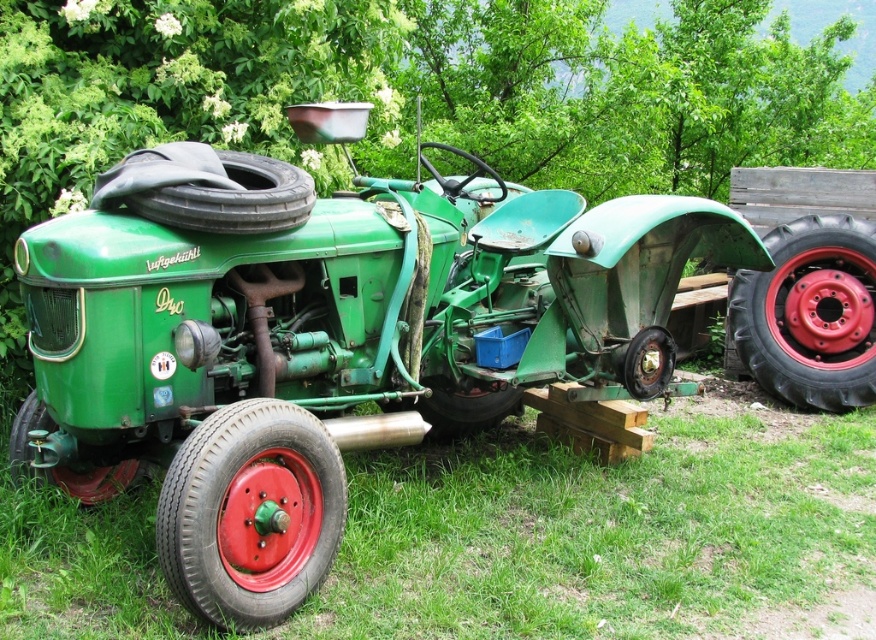
You are a farmer who needs to move a heavy object from the tractor to the barn, which is 3.27 meters away. The tractor has a black rubber tire at center. Can you use the tractor to transport the object to the barn?

The distance between the tractor and the barn is 3.27 meters. Since the tractor can move, you can drive it to the barn to transport the object.